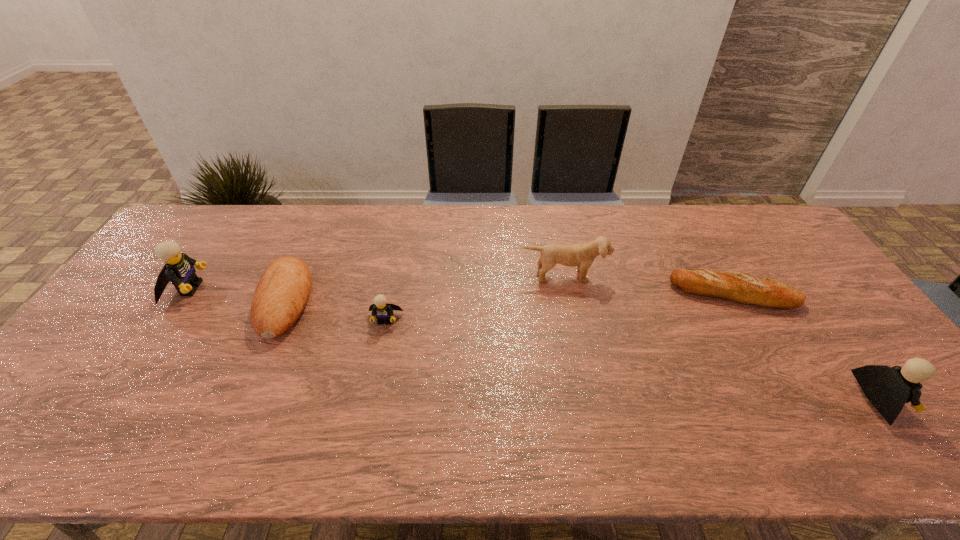
You are a GUI agent. You are given a task and a screenshot of the screen. Output one action in this format:
    pyautogui.click(x=<x>, y=<y>)
    Task: Click on the free space at the near edge of the desktop
    The height and width of the screenshot is (540, 960).
    Given the screenshot: What is the action you would take?
    pyautogui.click(x=756, y=384)

Image resolution: width=960 pixels, height=540 pixels. What are the coordinates of `vacant space at the left edge of the desktop` in the screenshot? It's located at (168, 305).

This screenshot has width=960, height=540. Find the location of `free space at the far left corner of the desktop`. free space at the far left corner of the desktop is located at coordinates (209, 211).

Locate an element on the screen. free location at the near left corner is located at coordinates (89, 388).

Where is `vacant space at the far right corner of the desktop`? The height and width of the screenshot is (540, 960). vacant space at the far right corner of the desktop is located at coordinates (771, 229).

The width and height of the screenshot is (960, 540). I want to click on blank region between the puppy and the nearest Lego, so click(x=722, y=338).

At what (x,y) coordinates should I click in order to perform the action: click on free space that is in between the shortest object and the nearest object. Please return your answer as a coordinate pair (x, y). Looking at the image, I should click on (807, 347).

Locate an element on the screen. The image size is (960, 540). unoccupied area between the second nearest Lego and the fourth object from left to right is located at coordinates (474, 298).

Locate an element on the screen. This screenshot has width=960, height=540. free space between the puppy and the second object from left to right is located at coordinates (424, 288).

I want to click on free point between the baguet and the farthest Lego, so click(x=461, y=291).